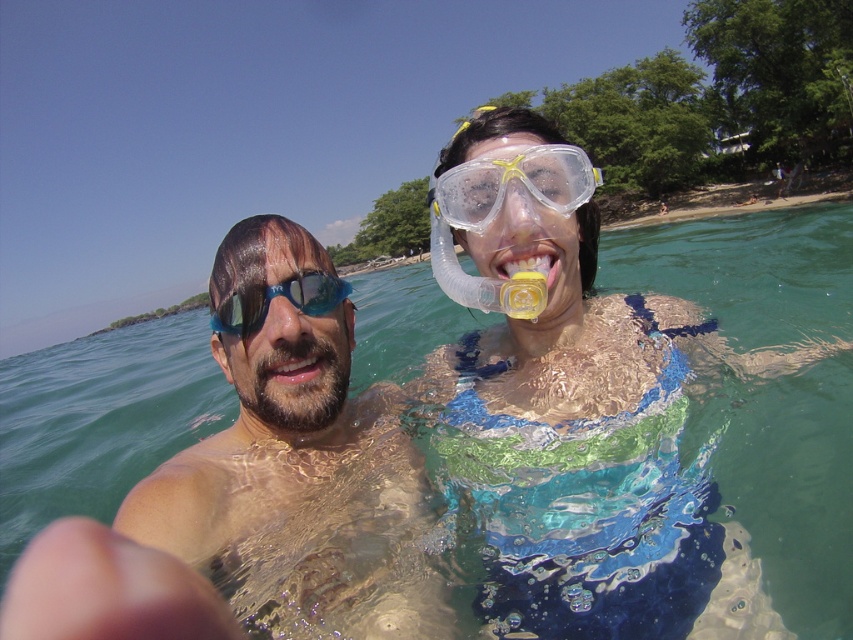
Question: Among these points, which one is nearest to the camera?

Choices:
 (A) (576, 163)
 (B) (302, 346)

Answer: (A)

Question: Which object is the farthest from the matte skin nose at center?

Choices:
 (A) pink glossy lips at center
 (B) transparent plastic goggles at center
 (C) transparent plastic snorkel at center
 (D) blue matte goggles at left

Answer: (C)

Question: Which of the following is the closest to the observer?

Choices:
 (A) transparent plastic snorkel at center
 (B) pink glossy lips at center
 (C) shiny blue goggles at center
 (D) blue matte goggles at left

Answer: (C)

Question: In this image, where is pink glossy lips at center located relative to transparent plastic snorkel at center?

Choices:
 (A) above
 (B) below

Answer: (B)

Question: In this image, where is blue matte goggles at left located relative to matte skin nose at center?

Choices:
 (A) below
 (B) above

Answer: (A)

Question: Is the position of shiny blue goggles at center more distant than that of blue matte goggles at left?

Choices:
 (A) yes
 (B) no

Answer: (B)